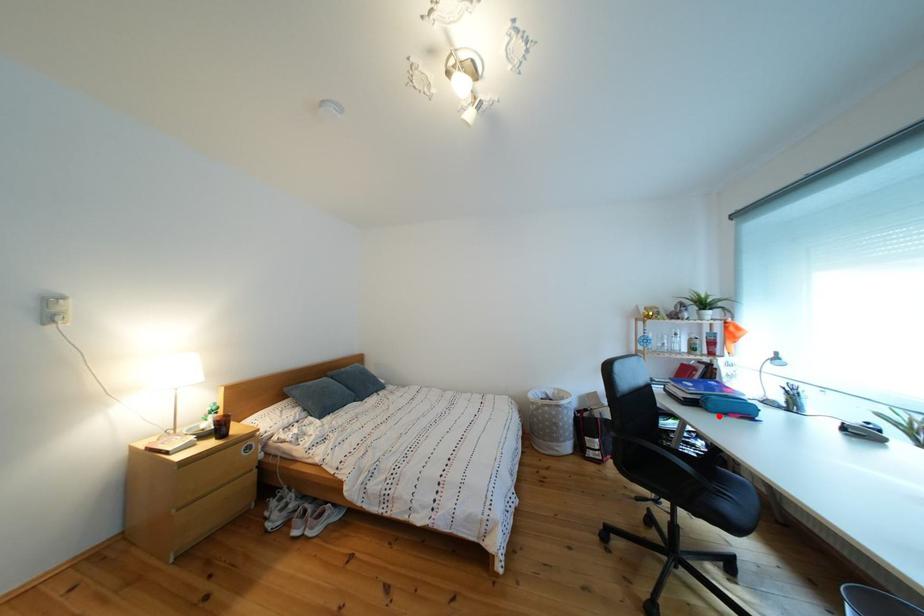
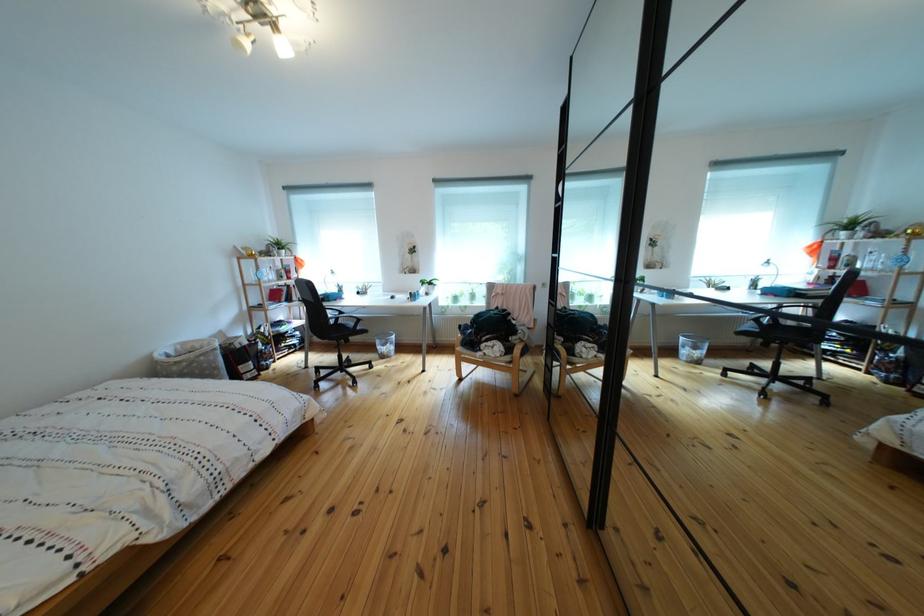
Question: I am providing you with two images of the same scene from different viewpoints. Image1 has a red point marked. In image2, the corresponding 3D location appears at what relative position? Reply with the corresponding letter.

Choices:
 (A) Closer
 (B) Farther

Answer: (A)